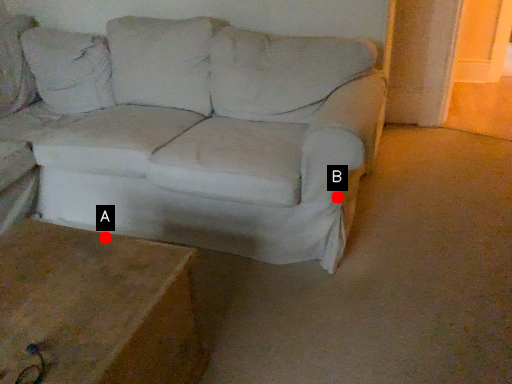
Question: Two points are circled on the image, labeled by A and B beside each circle. Among these points, which one is farthest from the camera?

Choices:
 (A) A is further
 (B) B is further

Answer: (B)